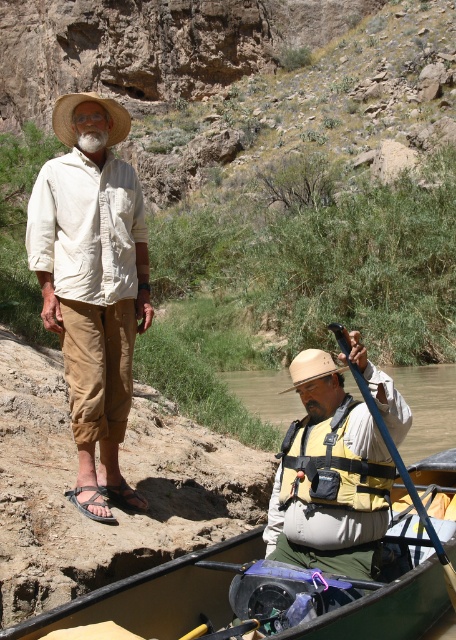
You are a hiker trying to locate your friend who is wearing matte khaki pants at left. According to the image, where exactly should you look to find them?

You should look at point (93, 284) to find matte khaki pants at left.

You are a hiker who needs to cross a river that is 30 feet wide. You see a matte khaki pants at left and a straw hat at lower center in the scene. Based on their positions, can you safely cross the river using the space between them?

The distance between the matte khaki pants at left and the straw hat at lower center is 29.91 feet, which is slightly less than the 30 feet width of the river. Therefore, the space between them is not wide enough for you to safely cross the river.

From the picture: You are a hiker planning to cross the river shown in the image. You need to know the distance between the point marked by coordinates point [93,284] and the nearest safe path. Can you determine if the distance is less than 5 meters?

The point marked by coordinates point [93,284] corresponds to matte khaki pants at left, which is part of the man standing on the bank. Since the scene is rugged and arid, the nearest safe path is likely along the riverbank. However, without specific distance data between the point and the path, I cannot confirm if it is less than 5 meters.